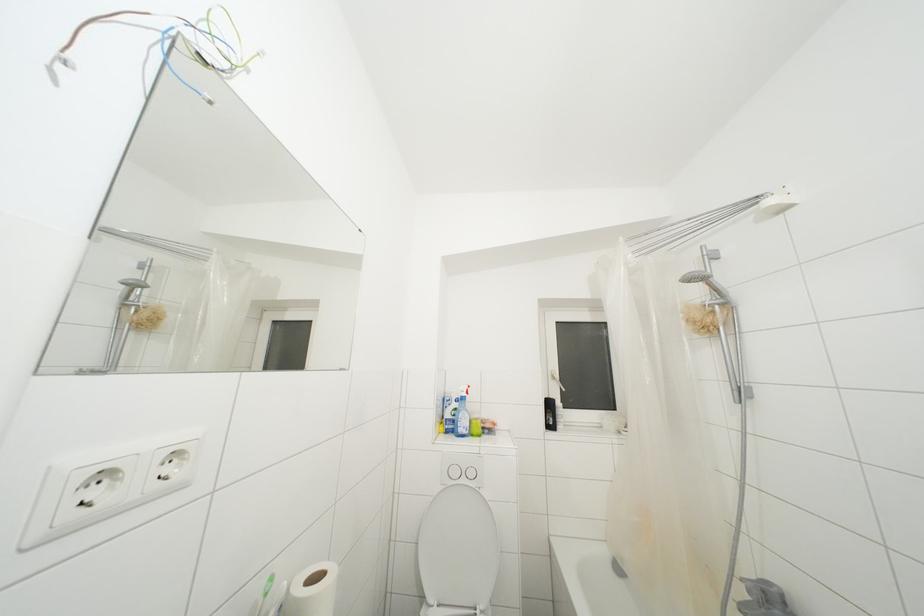
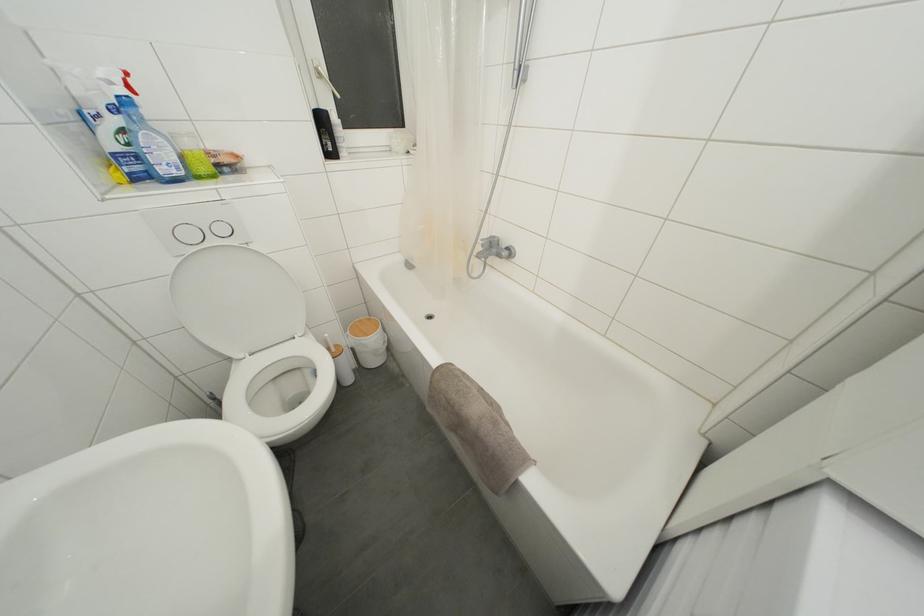
Where in the second image is the point corresponding to (553,410) from the first image?

(325, 126)